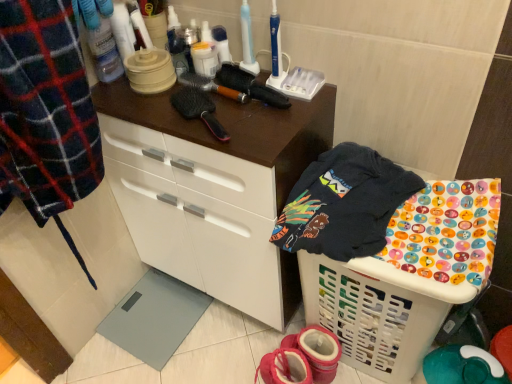
In order to face dark blue cotton t-shirt at upper right, should I rotate leftwards or rightwards?

Turn right by 12.375 degrees to look at dark blue cotton t-shirt at upper right.

What is the approximate width of matte white cabinet at center?

It is 14.32 inches.

Find the location of a particular element. Image resolution: width=512 pixels, height=384 pixels. white plastic laundry basket at lower right is located at coordinates pyautogui.click(x=377, y=312).

This screenshot has height=384, width=512. In order to click on pink fabric booties at lower center in this screenshot , I will do `click(302, 358)`.

In the scene shown: How distant is black synthetic hairbrush at upper center from white plastic laundry basket at lower right?

They are 24.89 inches apart.

Considering the positions of points (241, 96) and (404, 294), is point (241, 96) farther from camera compared to point (404, 294)?

Yes, it is.

Looking at their sizes, would you say black synthetic hairbrush at upper center is wider or thinner than white plastic laundry basket at lower right?

Clearly, black synthetic hairbrush at upper center has less width compared to white plastic laundry basket at lower right.

From the image's perspective, which one is positioned lower, black synthetic hairbrush at upper center or white plastic laundry basket at lower right?

white plastic laundry basket at lower right.

Identify the location of clothing in front of the white plastic laundry basket at lower right. This screenshot has width=512, height=384. (344, 203).

Is white plastic laundry basket at lower right at the back of dark blue cotton t-shirt at upper right?

No.

Is dark blue cotton t-shirt at upper right smaller than white plastic laundry basket at lower right?

Yes, dark blue cotton t-shirt at upper right is smaller than white plastic laundry basket at lower right.

Can white plastic laundry basket at lower right be found inside pink fabric booties at lower center?

Actually, white plastic laundry basket at lower right is outside pink fabric booties at lower center.

From a real-world perspective, is pink fabric booties at lower center physically located above or below white plastic laundry basket at lower right?

From a real-world perspective, pink fabric booties at lower center is physically below white plastic laundry basket at lower right.

Between pink fabric booties at lower center and white plastic laundry basket at lower right, which one has larger width?

With larger width is white plastic laundry basket at lower right.

From the image's perspective, which one is positioned higher, pink fabric booties at lower center or matte white cabinet at center?

matte white cabinet at center, from the image's perspective.

Which is more to the right, pink fabric booties at lower center or matte white cabinet at center?

Positioned to the right is pink fabric booties at lower center.

Is pink fabric booties at lower center thinner than matte white cabinet at center?

Correct, the width of pink fabric booties at lower center is less than that of matte white cabinet at center.

Is point (298, 347) closer or farther from the camera than point (190, 212)?

Point (298, 347) is positioned farther from the camera compared to point (190, 212).

Locate an element on the screen. basket below the matte white cabinet at center (from the image's perspective) is located at coordinates (377, 312).

Considering the relative sizes of matte white cabinet at center and white plastic laundry basket at lower right in the image provided, is matte white cabinet at center taller than white plastic laundry basket at lower right?

Correct, matte white cabinet at center is much taller as white plastic laundry basket at lower right.

Is matte white cabinet at center closer to camera compared to white plastic laundry basket at lower right?

No, matte white cabinet at center is further to the viewer.

Which point is more forward, (314, 122) or (358, 298)?

Point (314, 122)

Which object is more forward, matte white cabinet at center or dark blue cotton t-shirt at upper right?

dark blue cotton t-shirt at upper right.

Find the location of a particular element. cabinetry behind the dark blue cotton t-shirt at upper right is located at coordinates (213, 190).

Can you confirm if white plastic laundry basket at lower right is positioned to the right of matte white cabinet at center?

Yes.

Is white plastic laundry basket at lower right facing away from matte white cabinet at center?

That's not correct — white plastic laundry basket at lower right is not looking away from matte white cabinet at center.

How much distance is there between white plastic laundry basket at lower right and matte white cabinet at center?

A distance of 12.21 inches exists between white plastic laundry basket at lower right and matte white cabinet at center.

Identify the location of basket located in front of the matte white cabinet at center. (377, 312).

I want to click on basket directly beneath the black synthetic hairbrush at upper center (from a real-world perspective), so click(x=377, y=312).

Where is `clothing on the left of white plastic laundry basket at lower right`? clothing on the left of white plastic laundry basket at lower right is located at coordinates (344, 203).

When comparing their distances from white plastic laundry basket at lower right, does dark blue cotton t-shirt at upper right or matte white cabinet at center seem further?

Based on the image, matte white cabinet at center appears to be further to white plastic laundry basket at lower right.

Based on their spatial positions, is black synthetic hairbrush at upper center or dark blue cotton t-shirt at upper right further from white plastic laundry basket at lower right?

Based on the image, black synthetic hairbrush at upper center appears to be further to white plastic laundry basket at lower right.

Based on their spatial positions, is matte white cabinet at center or white plastic laundry basket at lower right closer to pink fabric booties at lower center?

Based on the image, white plastic laundry basket at lower right appears to be nearer to pink fabric booties at lower center.

When comparing their distances from dark blue cotton t-shirt at upper right, does white plastic laundry basket at lower right or black synthetic hairbrush at upper center seem further?

black synthetic hairbrush at upper center.

Estimate the real-world distances between objects in this image. Which object is further from pink fabric booties at lower center, black synthetic hairbrush at upper center or white plastic laundry basket at lower right?

black synthetic hairbrush at upper center.

Based on the photo, which object lies nearer to the anchor point dark blue cotton t-shirt at upper right, pink fabric booties at lower center or matte white cabinet at center?

matte white cabinet at center lies closer to dark blue cotton t-shirt at upper right than the other object.

Based on their spatial positions, is white plastic laundry basket at lower right or matte white cabinet at center closer to pink fabric booties at lower center?

Based on the image, white plastic laundry basket at lower right appears to be nearer to pink fabric booties at lower center.

Looking at the image, which one is located further to matte white cabinet at center, white plastic laundry basket at lower right or dark blue cotton t-shirt at upper right?

white plastic laundry basket at lower right.

The width and height of the screenshot is (512, 384). Identify the location of cabinetry between black synthetic hairbrush at upper center and pink fabric booties at lower center in the vertical direction. (213, 190).

Find the location of a particular element. Image resolution: width=512 pixels, height=384 pixels. cabinetry that lies between black synthetic hairbrush at upper center and white plastic laundry basket at lower right from top to bottom is located at coordinates (213, 190).

Find the location of `basket that lies between black synthetic hairbrush at upper center and pink fabric booties at lower center from top to bottom`. basket that lies between black synthetic hairbrush at upper center and pink fabric booties at lower center from top to bottom is located at coordinates (377, 312).

Where is `cabinetry located between black synthetic hairbrush at upper center and dark blue cotton t-shirt at upper right in the left-right direction`? cabinetry located between black synthetic hairbrush at upper center and dark blue cotton t-shirt at upper right in the left-right direction is located at coordinates (213, 190).